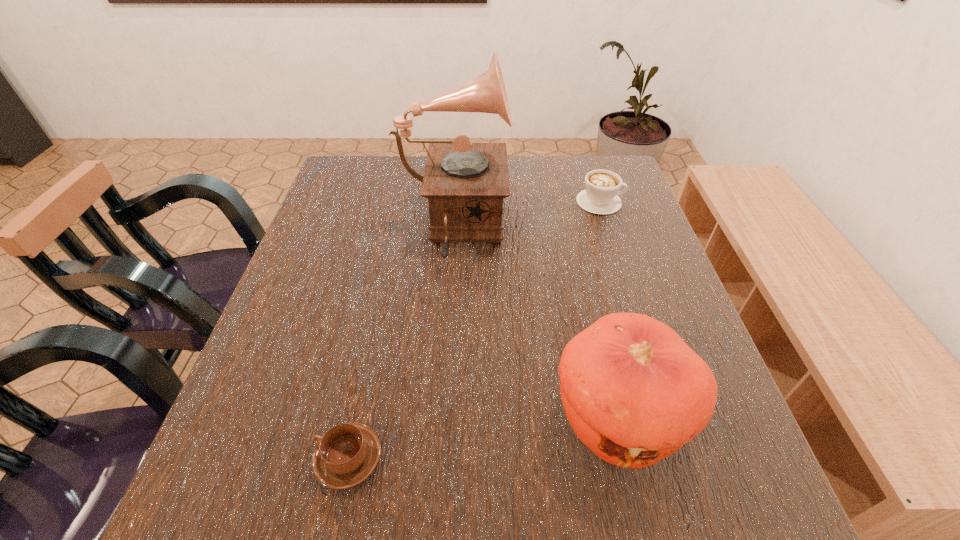
Identify the location of free space located on the side of the shorter cappuccino with the handle. This screenshot has width=960, height=540. point(284,458).

Locate an element on the screen. record player that is at the far edge is located at coordinates (465, 183).

Locate an element on the screen. The image size is (960, 540). cappuccino at the far edge is located at coordinates (600, 196).

Find the location of a particular element. pumpkin positioned at the near edge is located at coordinates (634, 392).

Identify the location of cappuccino located at the near edge. (347, 454).

I want to click on pumpkin that is at the right edge, so click(634, 392).

Where is `cappuccino that is at the right edge`? cappuccino that is at the right edge is located at coordinates (600, 196).

Locate an element on the screen. The height and width of the screenshot is (540, 960). object located in the far right corner section of the desktop is located at coordinates (600, 196).

What are the coordinates of `object at the near right corner` in the screenshot? It's located at (634, 392).

Locate an element on the screen. free space at the far edge of the desktop is located at coordinates (419, 183).